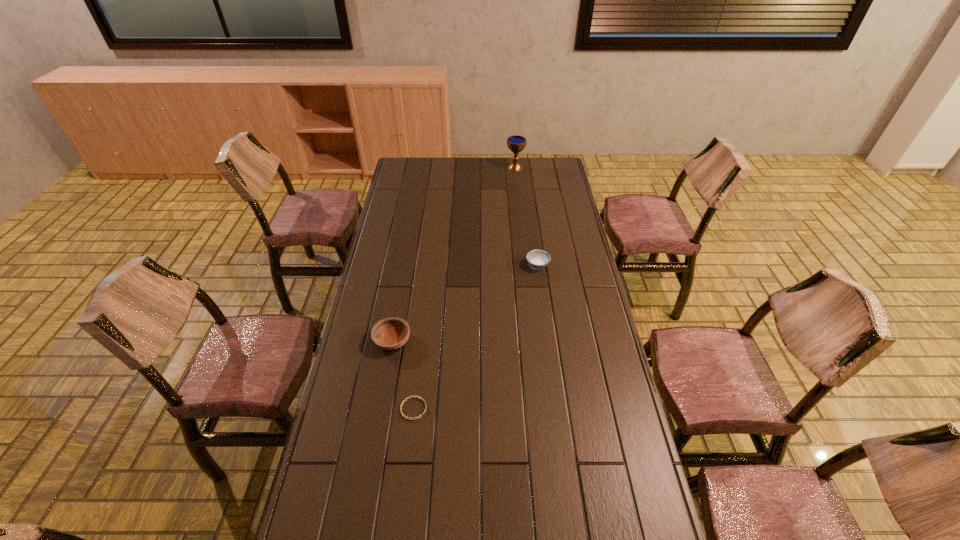
Where is `vacant space that's between the farthest object and the ashtray`? The width and height of the screenshot is (960, 540). vacant space that's between the farthest object and the ashtray is located at coordinates tap(526, 217).

In order to click on vacant area that lies between the third farthest object and the bracelet in this screenshot , I will do `click(403, 375)`.

In order to click on vacant space that's between the ashtray and the bracelet in this screenshot , I will do `click(475, 337)`.

Where is `empty space between the nearest object and the farthest object`? empty space between the nearest object and the farthest object is located at coordinates (465, 288).

Where is `empty location between the third shortest object and the ashtray`? The image size is (960, 540). empty location between the third shortest object and the ashtray is located at coordinates (465, 303).

What are the coordinates of `free spot between the farthest object and the bracelet` in the screenshot? It's located at (465, 288).

You are a GUI agent. You are given a task and a screenshot of the screen. Output one action in this format:
    pyautogui.click(x=<x>, y=<y>)
    Task: Click on the free area in between the bowl and the second shortest object
    The height and width of the screenshot is (540, 960).
    Given the screenshot: What is the action you would take?
    465,303

Identify the location of vacant area that lies between the second nearest object and the chalice. The image size is (960, 540). (454, 254).

Identify the location of object that can be found as the closest to the second shortest object. The image size is (960, 540). (392, 333).

You are a GUI agent. You are given a task and a screenshot of the screen. Output one action in this format:
    pyautogui.click(x=<x>, y=<y>)
    Task: Click on the object that stands as the third closest to the third nearest object
    This screenshot has width=960, height=540.
    Given the screenshot: What is the action you would take?
    pyautogui.click(x=516, y=143)